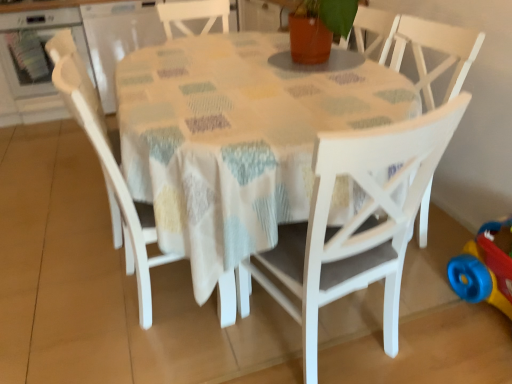
Question: From the image's perspective, is white wood chair at center, which is counted as the 2th chair, starting from the left, over transparent plastic container at upper left?

Choices:
 (A) no
 (B) yes

Answer: (A)

Question: Is white wood chair at center, which is counted as the 2th chair, starting from the left, behind transparent plastic container at upper left?

Choices:
 (A) no
 (B) yes

Answer: (A)

Question: Is white wood chair at center, which ranks as the second chair in right-to-left order, taller than transparent plastic container at upper left?

Choices:
 (A) yes
 (B) no

Answer: (A)

Question: Can you confirm if white wood chair at center, which is counted as the 2th chair, starting from the left, is bigger than transparent plastic container at upper left?

Choices:
 (A) no
 (B) yes

Answer: (A)

Question: Considering the relative positions of white wood chair at center, which ranks as the second chair in right-to-left order, and transparent plastic container at upper left in the image provided, is white wood chair at center, which ranks as the second chair in right-to-left order, to the right of transparent plastic container at upper left from the viewer's perspective?

Choices:
 (A) yes
 (B) no

Answer: (A)

Question: Are white wood chair at center, which ranks as the second chair in right-to-left order, and transparent plastic container at upper left located far from each other?

Choices:
 (A) yes
 (B) no

Answer: (A)

Question: From a real-world perspective, is white wood chair at center, which ranks as the second chair in right-to-left order, beneath rubberized plastic toy at lower right?

Choices:
 (A) no
 (B) yes

Answer: (A)

Question: Is white wood chair at center, which ranks as the second chair in right-to-left order, to the right of rubberized plastic toy at lower right from the viewer's perspective?

Choices:
 (A) no
 (B) yes

Answer: (A)

Question: Is white wood chair at center, which ranks as the second chair in right-to-left order, thinner than rubberized plastic toy at lower right?

Choices:
 (A) no
 (B) yes

Answer: (A)

Question: Is white wood chair at center, which ranks as the second chair in right-to-left order, shorter than rubberized plastic toy at lower right?

Choices:
 (A) yes
 (B) no

Answer: (B)

Question: From a real-world perspective, does white wood chair at center, which ranks as the second chair in right-to-left order, stand above rubberized plastic toy at lower right?

Choices:
 (A) no
 (B) yes

Answer: (B)

Question: Does white wood chair at center, which ranks as the second chair in right-to-left order, have a larger size compared to rubberized plastic toy at lower right?

Choices:
 (A) yes
 (B) no

Answer: (A)

Question: Is matte white chair at left, the 1th chair positioned from the left, completely or partially inside transparent plastic container at upper left?

Choices:
 (A) no
 (B) yes

Answer: (A)